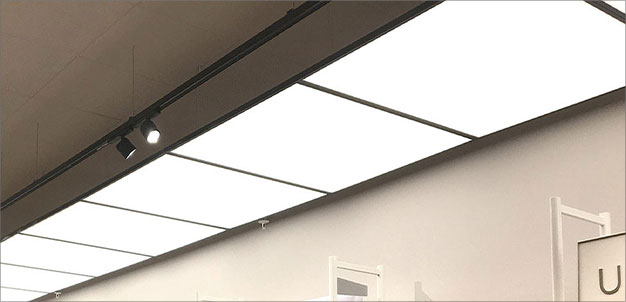
Where is `ceiling`? Image resolution: width=626 pixels, height=302 pixels. ceiling is located at coordinates (74, 51).